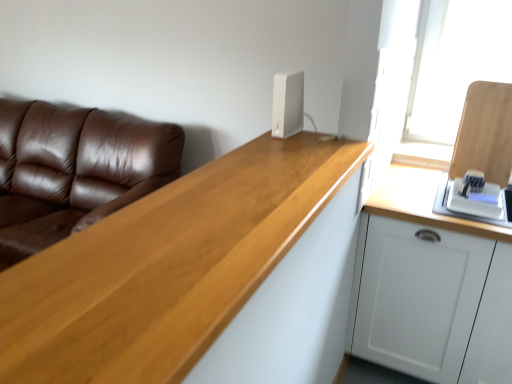
Question: Is point (360, 299) positioned closer to the camera than point (287, 82)?

Choices:
 (A) farther
 (B) closer

Answer: (A)

Question: Is white matte cabinet at right in front of or behind white plastic router at upper center in the image?

Choices:
 (A) behind
 (B) front

Answer: (B)

Question: Which of these objects is positioned farthest from the white plastic router at upper center?

Choices:
 (A) white matte cabinet at right
 (B) light wood countertop at center
 (C) brown leather couch at left

Answer: (C)

Question: Considering the real-world distances, which object is farthest from the white matte cabinet at right?

Choices:
 (A) light wood countertop at center
 (B) brown leather couch at left
 (C) white plastic router at upper center

Answer: (B)